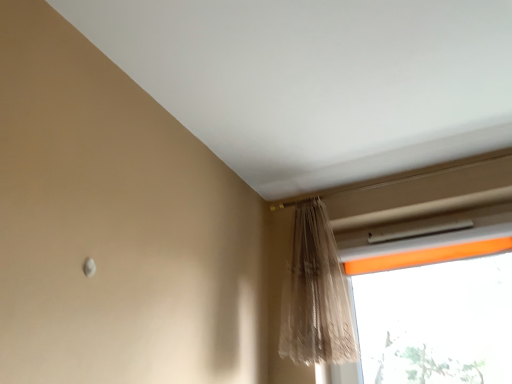
Question: From a real-world perspective, is orange fabric window at upper right positioned above or below sheer beige curtain at upper right?

Choices:
 (A) above
 (B) below

Answer: (B)

Question: Is orange fabric window at upper right situated inside sheer beige curtain at upper right or outside?

Choices:
 (A) outside
 (B) inside

Answer: (A)

Question: From the image's perspective, is orange fabric window at upper right above or below sheer beige curtain at upper right?

Choices:
 (A) below
 (B) above

Answer: (A)

Question: From the image's perspective, relative to orange fabric window at upper right, is sheer beige curtain at upper right above or below?

Choices:
 (A) below
 (B) above

Answer: (B)

Question: Visually, is sheer beige curtain at upper right positioned to the left or to the right of orange fabric window at upper right?

Choices:
 (A) left
 (B) right

Answer: (A)

Question: From a real-world perspective, is sheer beige curtain at upper right positioned above or below orange fabric window at upper right?

Choices:
 (A) below
 (B) above

Answer: (B)

Question: Is sheer beige curtain at upper right in front of or behind orange fabric window at upper right in the image?

Choices:
 (A) behind
 (B) front

Answer: (B)